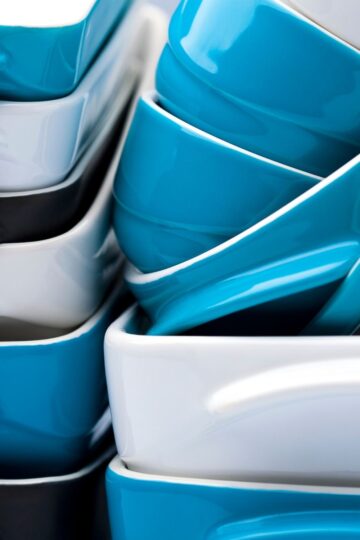
Image resolution: width=360 pixels, height=540 pixels. I want to click on bowls in right hand column, so click(x=294, y=516), click(x=290, y=424), click(x=343, y=315), click(x=295, y=279), click(x=256, y=192), click(x=271, y=127).